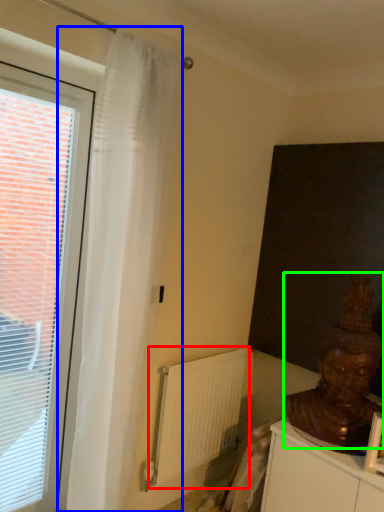
Question: Which is nearer to the radiator (highlighted by a red box)? curtain (highlighted by a blue box) or person (highlighted by a green box).

Choices:
 (A) curtain
 (B) person

Answer: (A)